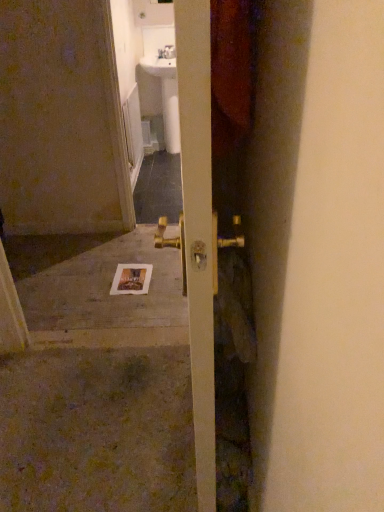
Question: From their relative heights in the image, would you say gold metallic door handle at center is taller or shorter than white glossy sink at upper center?

Choices:
 (A) tall
 (B) short

Answer: (A)

Question: From a real-world perspective, is gold metallic door handle at center physically located above or below white glossy sink at upper center?

Choices:
 (A) below
 (B) above

Answer: (B)

Question: Estimate the real-world distances between objects in this image. Which object is farther from the white glossy sink at upper center?

Choices:
 (A) gold metallic door handle at center
 (B) white concrete at center
 (C) white paper postcard at center

Answer: (A)

Question: Estimate the real-world distances between objects in this image. Which object is farther from the white glossy sink at upper center?

Choices:
 (A) white concrete at center
 (B) gold metallic door handle at center
 (C) white paper postcard at center

Answer: (B)